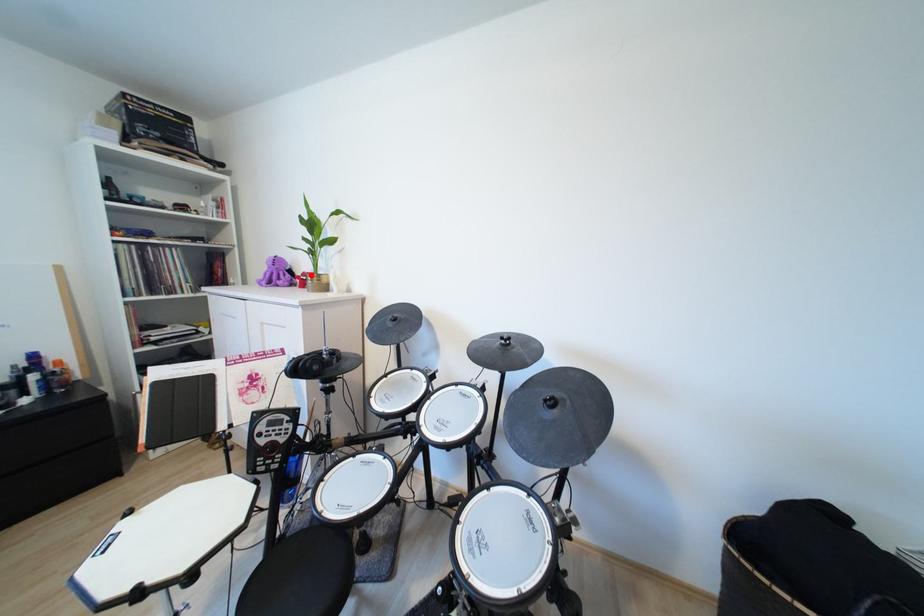
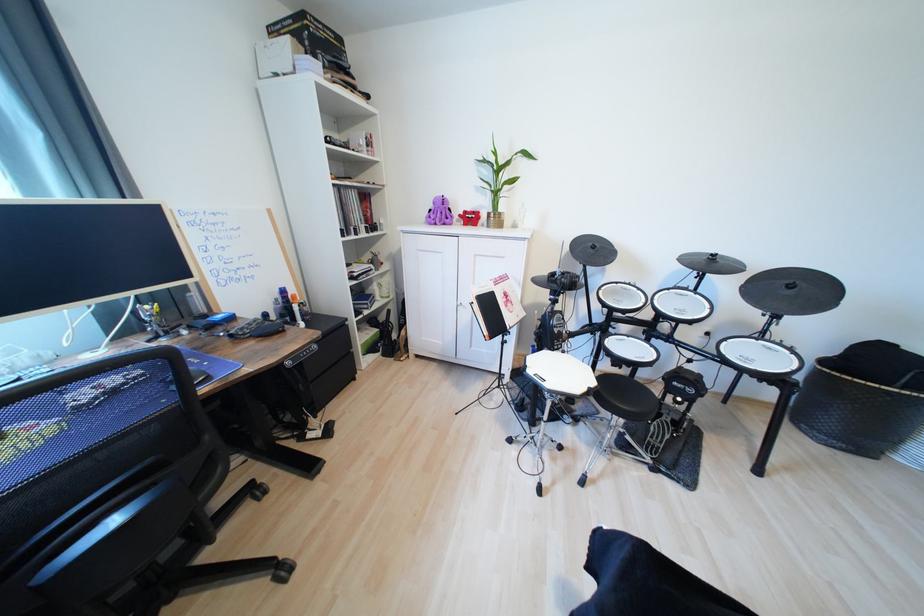
Find the pixel in the second image that matches the highlighted location in the first image.

(472, 214)